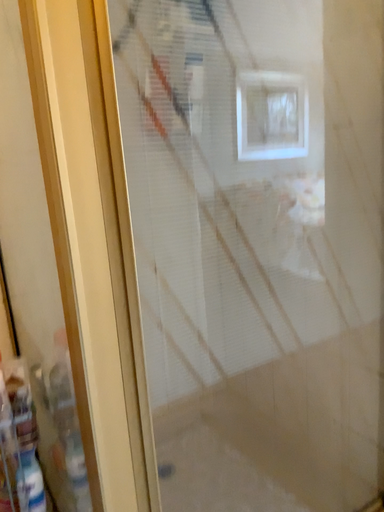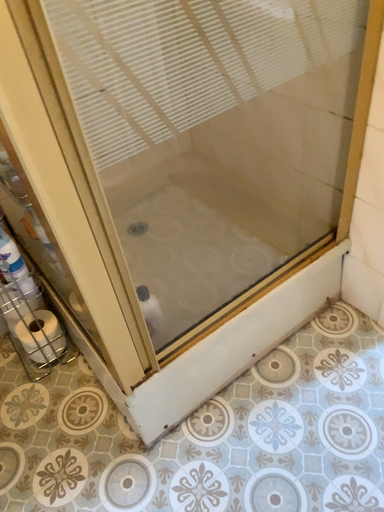
Question: How did the camera likely rotate when shooting the video?

Choices:
 (A) rotated upward
 (B) rotated downward

Answer: (B)